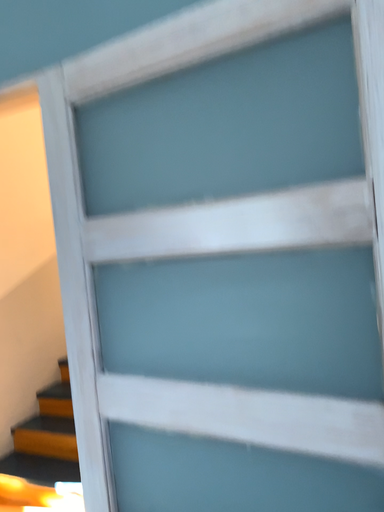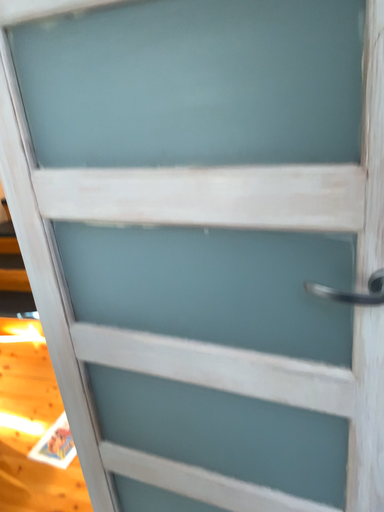
Question: Which way did the camera rotate in the video?

Choices:
 (A) rotated downward
 (B) rotated upward

Answer: (A)